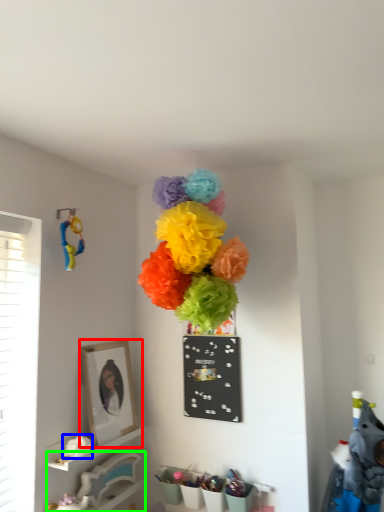
Question: Which object is positioned farthest from picture frame (highlighted by a red box)? Select from flower (highlighted by a blue box) and furniture (highlighted by a green box).

Choices:
 (A) flower
 (B) furniture

Answer: (B)